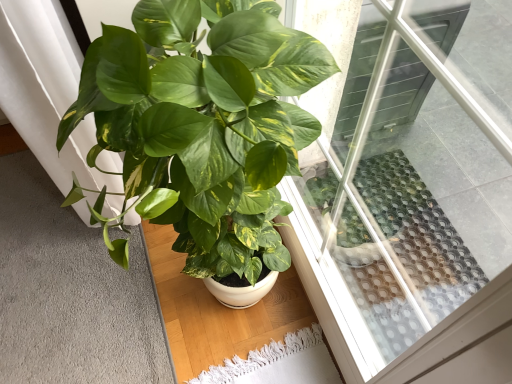
At what (x,y) coordinates should I click in order to perform the action: click on vacant space positioned to the left of green glossy leafy plant at center. Please return your answer as a coordinate pair (x, y). The height and width of the screenshot is (384, 512). Looking at the image, I should click on (74, 307).